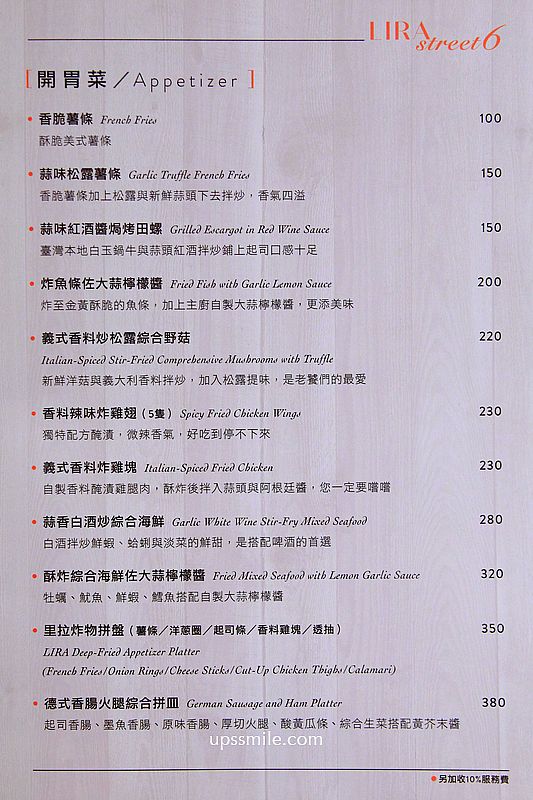
Locate an element on the screen. brackets is located at coordinates (249, 72), (23, 78).